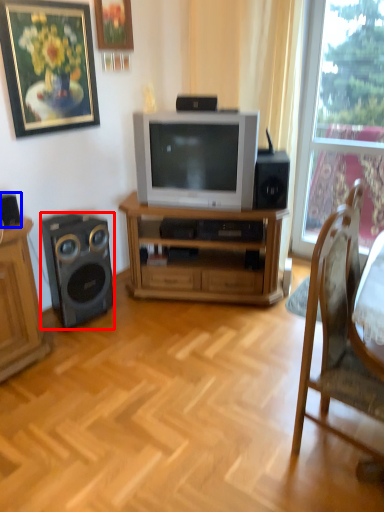
Question: Among these objects, which one is farthest to the camera, loudspeaker (highlighted by a red box) or speaker (highlighted by a blue box)?

Choices:
 (A) loudspeaker
 (B) speaker

Answer: (A)